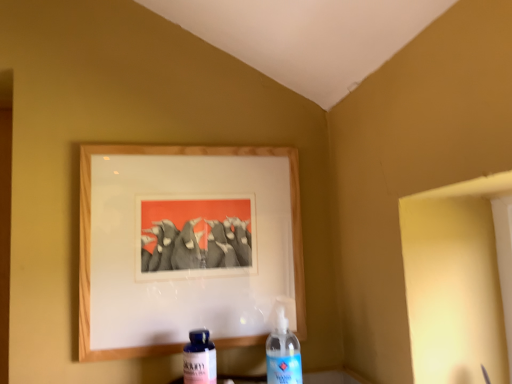
Question: Should I look upward or downward to see transparent plastic bottle at center, which ranks as the 2th bottle in left-to-right order?

Choices:
 (A) up
 (B) down

Answer: (B)

Question: Is blue glass bottle at lower center, marked as the first bottle in a left-to-right arrangement, behind wooden picture frame at upper center?

Choices:
 (A) yes
 (B) no

Answer: (B)

Question: Is blue glass bottle at lower center, which ranks as the 2th bottle in right-to-left order, beside wooden picture frame at upper center?

Choices:
 (A) yes
 (B) no

Answer: (B)

Question: From a real-world perspective, is blue glass bottle at lower center, marked as the first bottle in a left-to-right arrangement, on top of wooden picture frame at upper center?

Choices:
 (A) yes
 (B) no

Answer: (B)

Question: Would you say wooden picture frame at upper center is part of blue glass bottle at lower center, marked as the first bottle in a left-to-right arrangement,'s contents?

Choices:
 (A) no
 (B) yes

Answer: (A)

Question: Considering the relative sizes of blue glass bottle at lower center, marked as the first bottle in a left-to-right arrangement, and wooden picture frame at upper center in the image provided, is blue glass bottle at lower center, marked as the first bottle in a left-to-right arrangement, shorter than wooden picture frame at upper center?

Choices:
 (A) no
 (B) yes

Answer: (B)

Question: From the image's perspective, is blue glass bottle at lower center, marked as the first bottle in a left-to-right arrangement, beneath wooden picture frame at upper center?

Choices:
 (A) no
 (B) yes

Answer: (B)

Question: Does transparent plastic bottle at center, which is counted as the 1th bottle, starting from the right, have a smaller size compared to wooden picture frame at upper center?

Choices:
 (A) yes
 (B) no

Answer: (A)

Question: Would you consider transparent plastic bottle at center, which ranks as the 2th bottle in left-to-right order, to be distant from wooden picture frame at upper center?

Choices:
 (A) yes
 (B) no

Answer: (B)

Question: Can you confirm if transparent plastic bottle at center, which ranks as the 2th bottle in left-to-right order, is taller than wooden picture frame at upper center?

Choices:
 (A) no
 (B) yes

Answer: (A)

Question: Considering the relative sizes of transparent plastic bottle at center, which is counted as the 1th bottle, starting from the right, and wooden picture frame at upper center in the image provided, is transparent plastic bottle at center, which is counted as the 1th bottle, starting from the right, thinner than wooden picture frame at upper center?

Choices:
 (A) no
 (B) yes

Answer: (A)

Question: Does transparent plastic bottle at center, which is counted as the 1th bottle, starting from the right, lie in front of wooden picture frame at upper center?

Choices:
 (A) no
 (B) yes

Answer: (B)

Question: Is wooden picture frame at upper center at the back of transparent plastic bottle at center, which is counted as the 1th bottle, starting from the right?

Choices:
 (A) yes
 (B) no

Answer: (A)

Question: Are wooden picture frame at upper center and transparent plastic bottle at center, which ranks as the 2th bottle in left-to-right order, far apart?

Choices:
 (A) yes
 (B) no

Answer: (B)